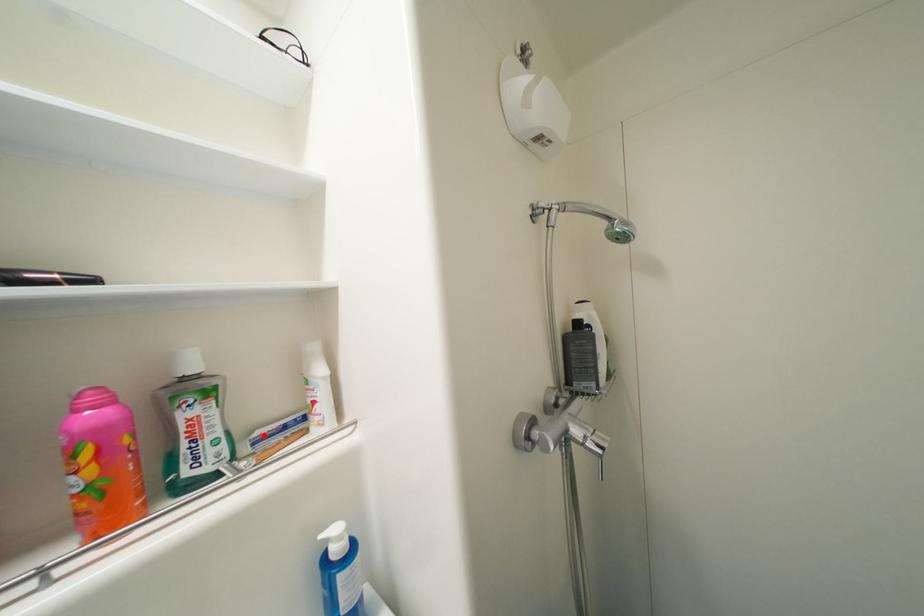
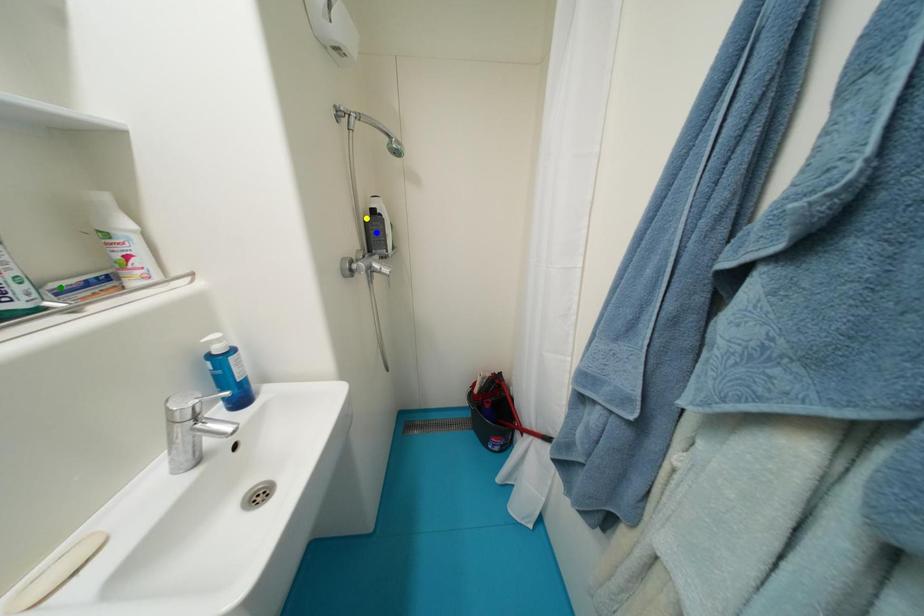
Question: I am providing you with two images of the same scene from different viewpoints. A red point is marked on the first image. You are given multiple points on the second image. In image 2, which mark is for the same physical point as the one in image 1?

Choices:
 (A) yellow point
 (B) blue point
 (C) green point

Answer: (C)